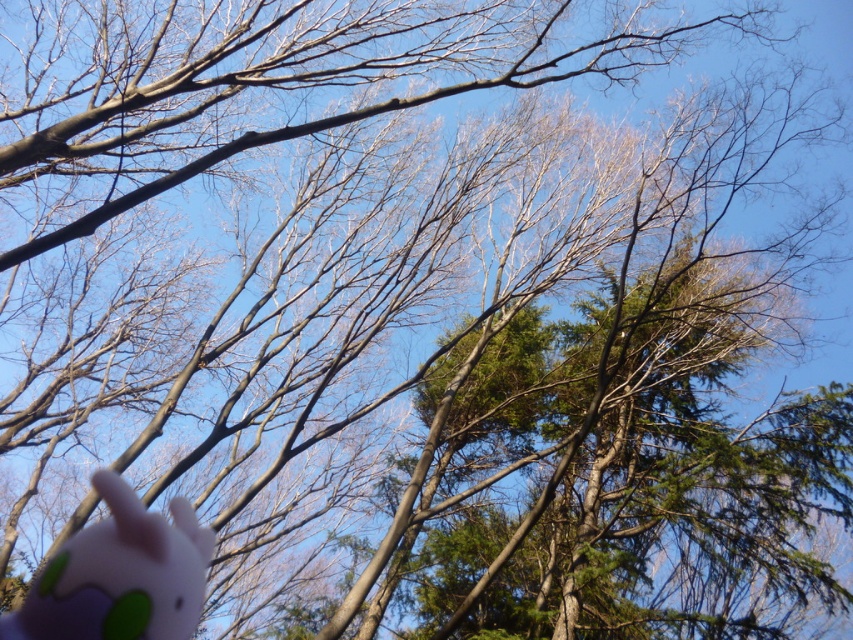
Question: Observing the image, what is the correct spatial positioning of brown matte branch at upper center in reference to pink rubber toy at lower left?

Choices:
 (A) above
 (B) below

Answer: (A)

Question: Does brown matte branch at upper center appear under pink rubber toy at lower left?

Choices:
 (A) no
 (B) yes

Answer: (A)

Question: Which of the following is the farthest from the observer?

Choices:
 (A) brown matte branch at upper center
 (B) pink rubber toy at lower left

Answer: (B)

Question: Is brown matte branch at upper center to the left of pink rubber toy at lower left from the viewer's perspective?

Choices:
 (A) yes
 (B) no

Answer: (B)

Question: Which object appears farthest from the camera in this image?

Choices:
 (A) pink rubber toy at lower left
 (B) brown matte branch at upper center

Answer: (A)

Question: Among these objects, which one is farthest from the camera?

Choices:
 (A) pink rubber toy at lower left
 (B) brown matte branch at upper center

Answer: (A)